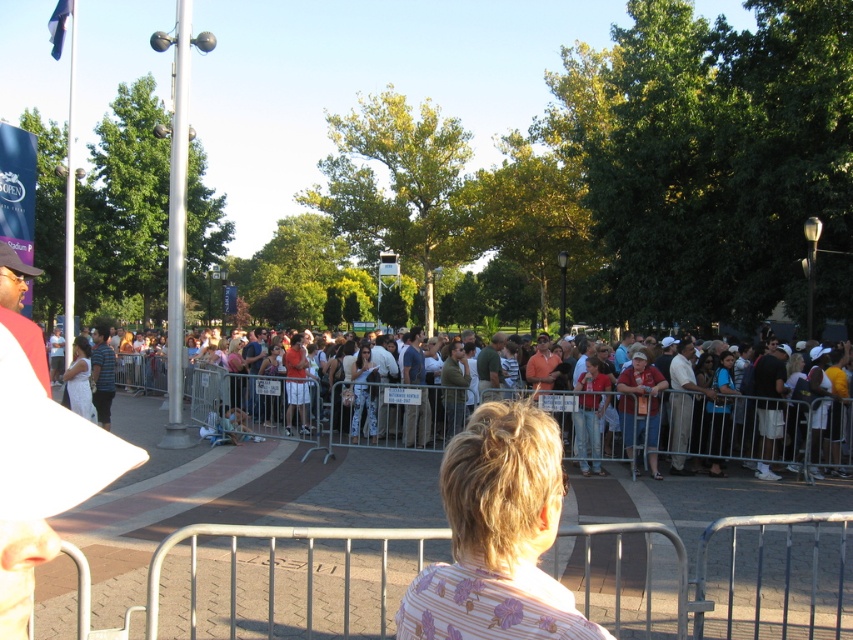
You are a photographer at the event and need to capture a photo of both the denim pants at center and the white cotton dress at center. Which one should you focus on first to ensure it appears taller in the photo?

The white cotton dress at center is taller than the denim pants at center, so you should focus on the white cotton dress at center first to ensure it appears taller in the photo.

You are a photographer at the event and want to capture both the denim pants at center and the white cotton dress at center in a single frame. Which clothing item will appear larger in your photo?

The white cotton dress at center will appear larger in the photo because it is bigger than the denim pants at center.